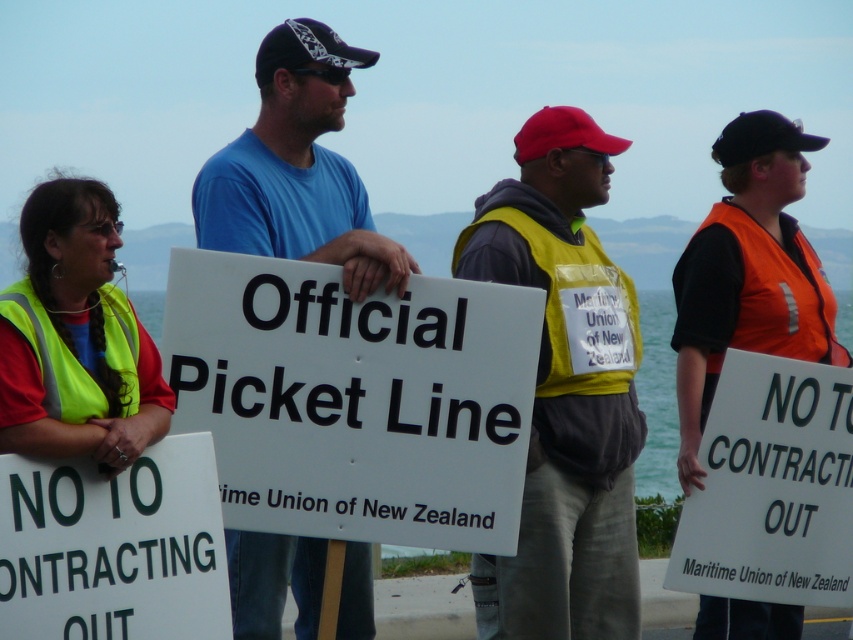
You are a photographer standing at the edge of the protest area. You want to take a photo that includes both the white paper sign at center and the orange reflective vest at center. Which object will appear larger in your photo?

The white paper sign at center will appear larger in the photo because it is closer to the viewer than the orange reflective vest at center.

You are a drone operator tasked with capturing aerial footage of the protest scene. The yellow reflective vest at center is located at coordinates point 0.613, 0.662. To ensure the vest is visible in the frame, which direction should you adjust the camera? The scene has a standard coordinate system where the bottom left corner is 0,0 and the top right corner is 1,1.

The yellow reflective vest at center is located at point (564,392). Since the coordinate system has the bottom left as (0,0) and top right as (852,639), the vest is positioned slightly to the right and above the center. To keep it in the frame, the camera should be adjusted to focus on that central area.

You are a pedestrian approaching the protest scene. You see the white plastic sign at center and the orange reflective vest at center. Which object is closer to the ground?

The white plastic sign at center is positioned under the orange reflective vest at center, so it is closer to the ground.